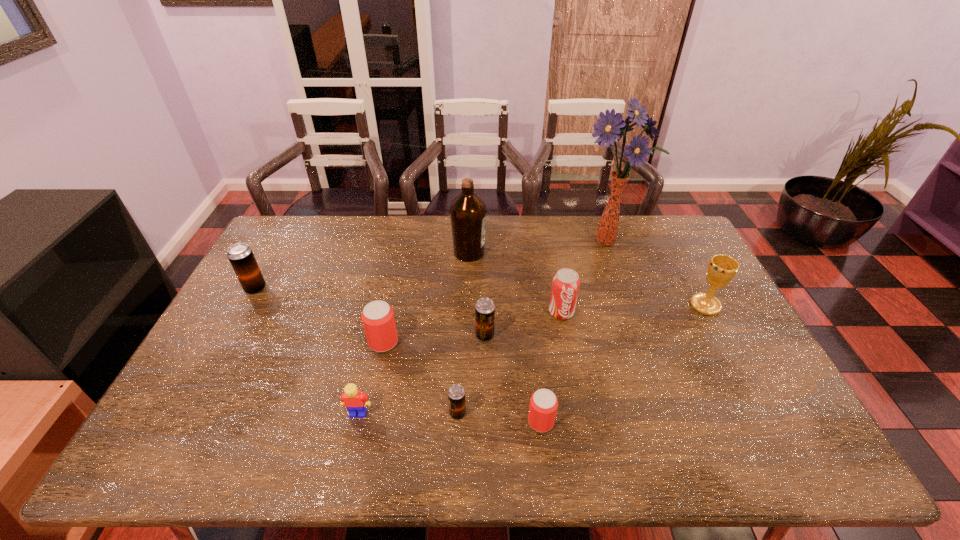
What are the coordinates of `flower arrangement` in the screenshot? It's located at (608, 128).

Where is `the tallest object`? the tallest object is located at coordinates (608, 128).

Identify the location of brown olive oil. The width and height of the screenshot is (960, 540). (468, 212).

At what (x,y) coordinates should I click in order to perform the action: click on olive oil. Please return your answer as a coordinate pair (x, y). The image size is (960, 540). Looking at the image, I should click on (468, 212).

Where is `chalice`? chalice is located at coordinates (722, 269).

Where is `gold chalice`? gold chalice is located at coordinates (722, 269).

Locate an element on the screen. This screenshot has height=540, width=960. the farthest black beer can is located at coordinates (241, 257).

This screenshot has width=960, height=540. Identify the location of the farthest beer can. (241, 257).

At what (x,y) coordinates should I click in order to perform the action: click on the eighth object from left to right. Please return your answer as a coordinate pair (x, y). This screenshot has width=960, height=540. Looking at the image, I should click on (565, 286).

At what (x,y) coordinates should I click in order to perform the action: click on soda can. Please return your answer as a coordinate pair (x, y). This screenshot has height=540, width=960. Looking at the image, I should click on (565, 286).